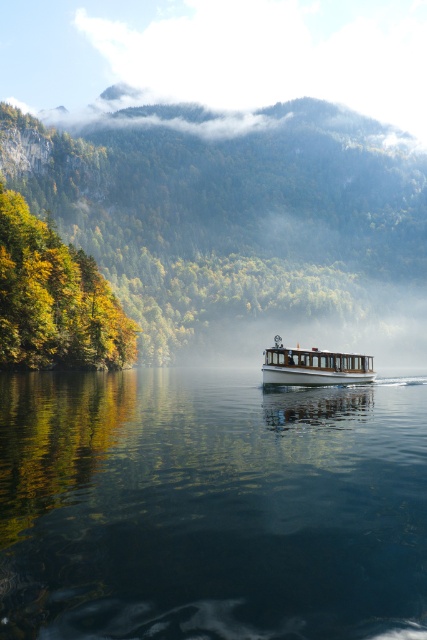
Question: Can you confirm if transparent glass water at center is wider than white wooden boat at center?

Choices:
 (A) no
 (B) yes

Answer: (B)

Question: Is transparent glass water at center wider than white wooden boat at center?

Choices:
 (A) no
 (B) yes

Answer: (B)

Question: Is transparent glass water at center thinner than white wooden boat at center?

Choices:
 (A) yes
 (B) no

Answer: (B)

Question: Which point is farther from the camera taking this photo?

Choices:
 (A) (173, 612)
 (B) (315, 371)

Answer: (B)

Question: Which object is closer to the camera taking this photo?

Choices:
 (A) transparent glass water at center
 (B) white wooden boat at center

Answer: (A)